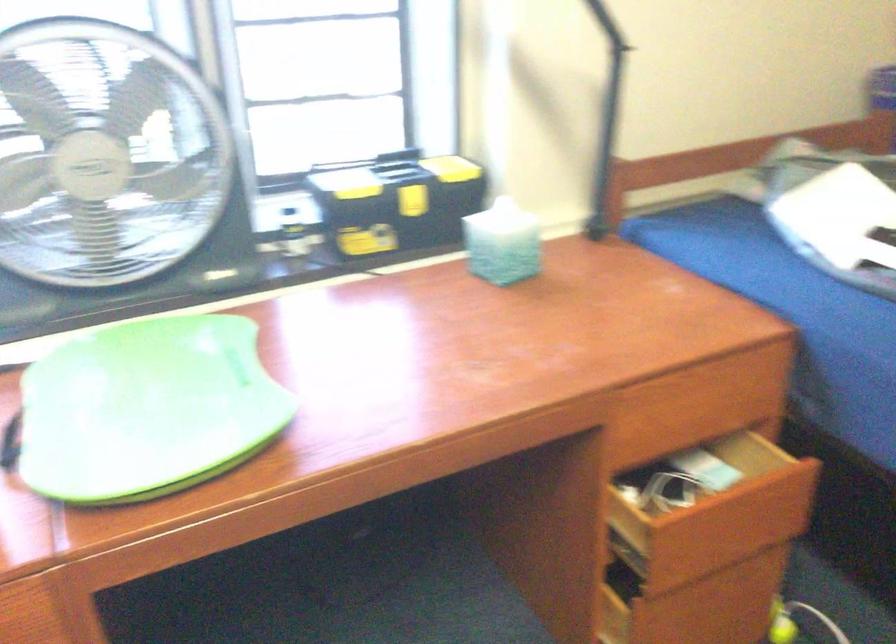
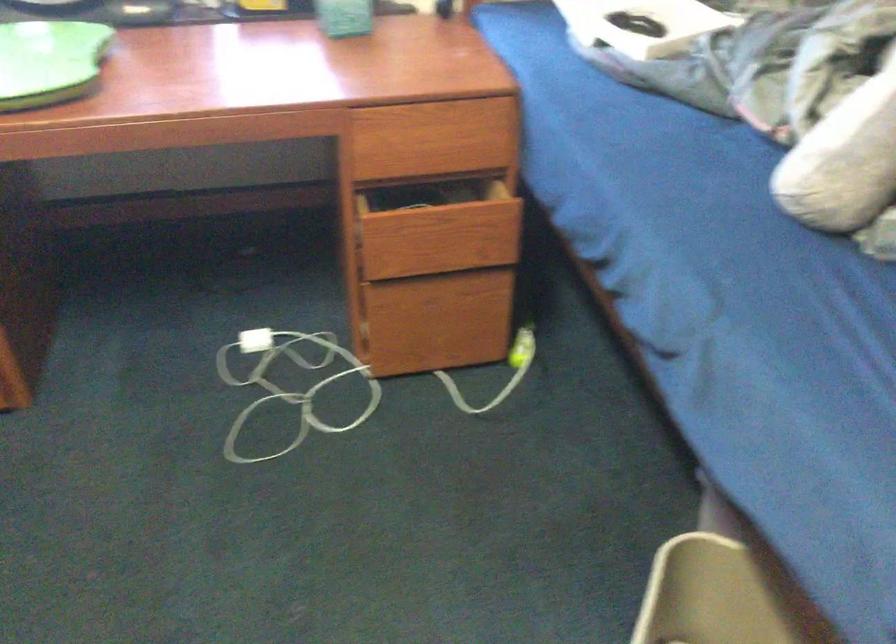
Which direction would the cameraman need to move to produce the second image?

The cameraman moved toward right, backward.